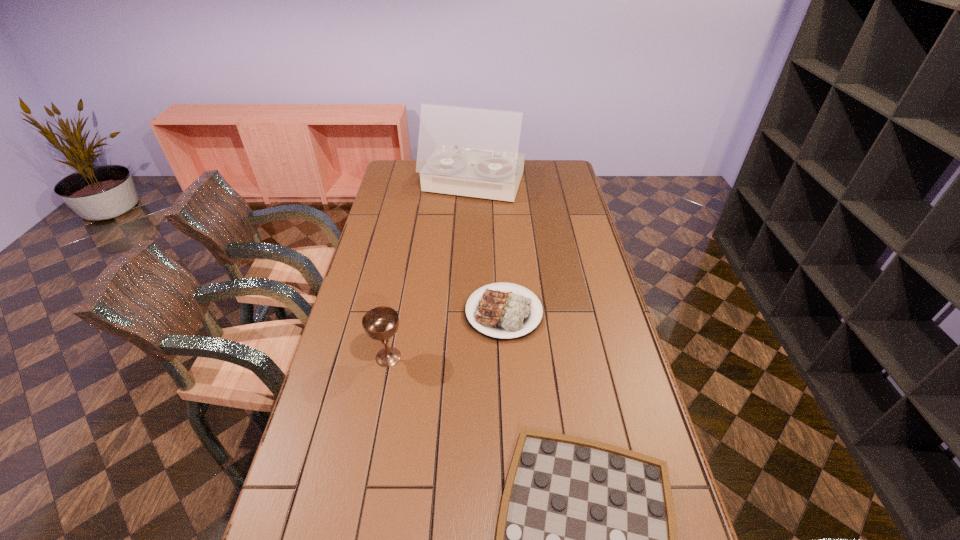
At what (x,y) coordinates should I click in order to perform the action: click on the farthest object. Please return your answer as a coordinate pair (x, y). Looking at the image, I should click on (465, 151).

At what (x,y) coordinates should I click in order to perform the action: click on the tallest object. Please return your answer as a coordinate pair (x, y). Image resolution: width=960 pixels, height=540 pixels. Looking at the image, I should click on (465, 151).

Where is `chalice`? The height and width of the screenshot is (540, 960). chalice is located at coordinates (381, 323).

Locate an element on the screen. This screenshot has height=540, width=960. plate is located at coordinates (502, 313).

You are a GUI agent. You are given a task and a screenshot of the screen. Output one action in this format:
    pyautogui.click(x=<x>, y=<y>)
    Task: Click on the vacant space located on the right of the tallest object
    
    Given the screenshot: What is the action you would take?
    pyautogui.click(x=568, y=185)

Locate an element on the screen. The width and height of the screenshot is (960, 540). blank space located on the back of the chalice is located at coordinates (397, 311).

Locate an element on the screen. The width and height of the screenshot is (960, 540). vacant space situated 0.090m on the right of the plate is located at coordinates (574, 313).

Where is `object that is positioned at the far edge`? object that is positioned at the far edge is located at coordinates (465, 151).

What are the coordinates of `object that is positioned at the left edge` in the screenshot? It's located at (381, 323).

Image resolution: width=960 pixels, height=540 pixels. In order to click on vacant position at the far edge of the desktop in this screenshot , I will do `click(533, 167)`.